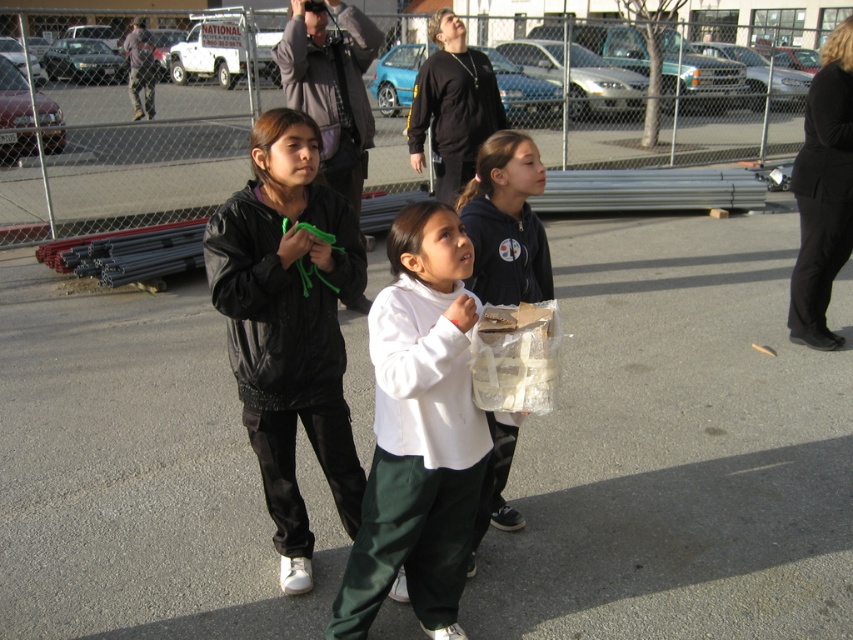
At what (x,y) coordinates should I click in order to perform the action: click on black matte jacket at center. Please return your answer as a coordinate pair (x, y). Looking at the image, I should click on (289, 324).

Can you confirm if black matte jacket at center is bigger than white matte shirt at center?

Indeed, black matte jacket at center has a larger size compared to white matte shirt at center.

Is point (289, 413) behind point (456, 348)?

Yes, point (289, 413) is farther from viewer.

What are the coordinates of `black matte jacket at center` in the screenshot? It's located at (289, 324).

Can you confirm if metallic chain-link fence at upper center is taller than black fabric pants at right?

Indeed, metallic chain-link fence at upper center has a greater height compared to black fabric pants at right.

Where is `metallic chain-link fence at upper center`? Image resolution: width=853 pixels, height=640 pixels. metallic chain-link fence at upper center is located at coordinates (601, 81).

The image size is (853, 640). What do you see at coordinates (601, 81) in the screenshot?
I see `metallic chain-link fence at upper center` at bounding box center [601, 81].

Does metallic chain-link fence at upper center have a larger size compared to black matte sweatshirt at upper center?

Correct, metallic chain-link fence at upper center is larger in size than black matte sweatshirt at upper center.

Identify the location of metallic chain-link fence at upper center. This screenshot has width=853, height=640. (601, 81).